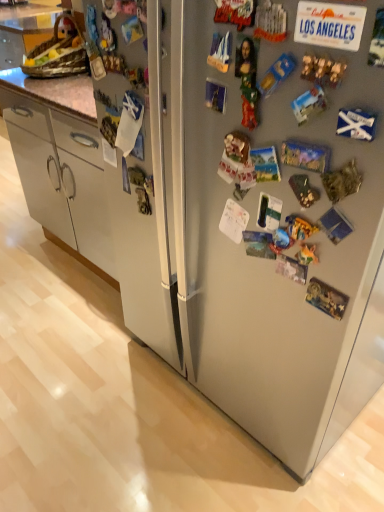
Question: Is wooden basket at upper left smaller than satin silver refrigerator at center?

Choices:
 (A) yes
 (B) no

Answer: (A)

Question: Does wooden basket at upper left appear on the left side of satin silver refrigerator at center?

Choices:
 (A) yes
 (B) no

Answer: (B)

Question: Considering the relative sizes of wooden basket at upper left and satin silver refrigerator at center in the image provided, is wooden basket at upper left wider than satin silver refrigerator at center?

Choices:
 (A) yes
 (B) no

Answer: (B)

Question: Can you see wooden basket at upper left touching satin silver refrigerator at center?

Choices:
 (A) no
 (B) yes

Answer: (A)

Question: Could satin silver refrigerator at center be considered to be inside wooden basket at upper left?

Choices:
 (A) yes
 (B) no

Answer: (B)

Question: From the image's perspective, is wooden basket at upper left on satin silver refrigerator at center?

Choices:
 (A) yes
 (B) no

Answer: (A)

Question: Can wooden basket at upper left be found inside satin silver refrigerator at center?

Choices:
 (A) yes
 (B) no

Answer: (B)

Question: Is satin silver refrigerator at center thinner than wooden basket at upper left?

Choices:
 (A) no
 (B) yes

Answer: (A)

Question: Can you confirm if satin silver refrigerator at center is taller than wooden basket at upper left?

Choices:
 (A) no
 (B) yes

Answer: (A)

Question: Is satin silver refrigerator at center not within wooden basket at upper left?

Choices:
 (A) no
 (B) yes

Answer: (B)

Question: Can you confirm if satin silver refrigerator at center is bigger than wooden basket at upper left?

Choices:
 (A) no
 (B) yes

Answer: (B)

Question: From a real-world perspective, is satin silver refrigerator at center positioned under wooden basket at upper left based on gravity?

Choices:
 (A) yes
 (B) no

Answer: (A)

Question: Relative to wooden basket at upper left, is satin silver refrigerator at center in front or behind?

Choices:
 (A) behind
 (B) front

Answer: (B)